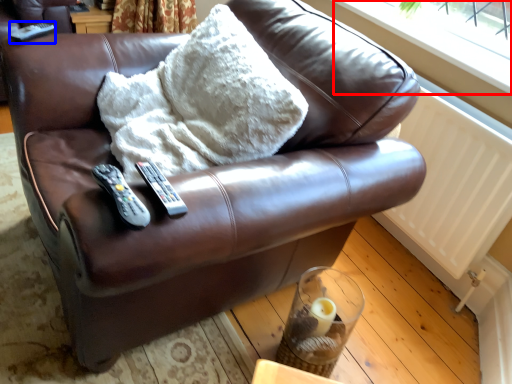
Question: Which object is closer to the camera taking this photo, window frame (highlighted by a red box) or remote (highlighted by a blue box)?

Choices:
 (A) window frame
 (B) remote

Answer: (A)